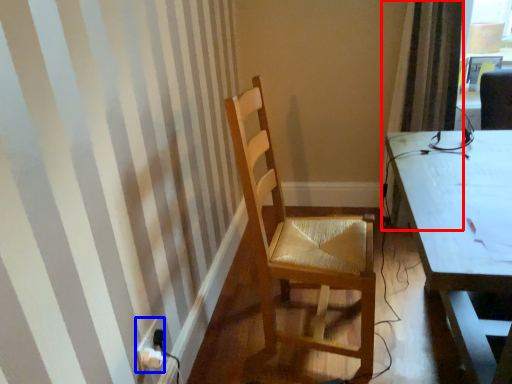
Question: Among these objects, which one is farthest to the camera, curtain (highlighted by a red box) or power plugs and sockets (highlighted by a blue box)?

Choices:
 (A) curtain
 (B) power plugs and sockets

Answer: (A)